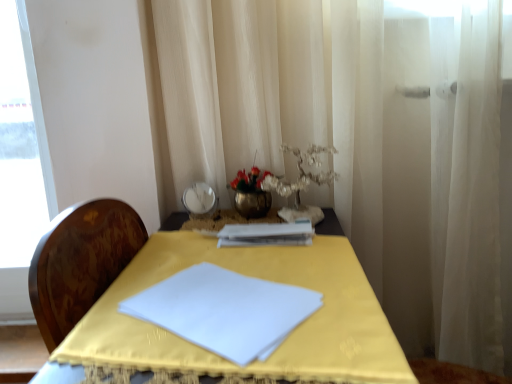
Question: Is white sheer curtain at right turned away from metallic vase at center?

Choices:
 (A) yes
 (B) no

Answer: (B)

Question: Considering the relative sizes of white sheer curtain at right and metallic vase at center in the image provided, is white sheer curtain at right shorter than metallic vase at center?

Choices:
 (A) no
 (B) yes

Answer: (A)

Question: Is white sheer curtain at right positioned behind metallic vase at center?

Choices:
 (A) yes
 (B) no

Answer: (B)

Question: Is metallic vase at center located within white sheer curtain at right?

Choices:
 (A) yes
 (B) no

Answer: (B)

Question: From the image's perspective, is white sheer curtain at right beneath metallic vase at center?

Choices:
 (A) yes
 (B) no

Answer: (A)

Question: Can you confirm if white sheer curtain at right is positioned to the left of metallic vase at center?

Choices:
 (A) yes
 (B) no

Answer: (B)

Question: Is yellow fabric table at center behind white sheer curtain at right?

Choices:
 (A) yes
 (B) no

Answer: (B)

Question: Is yellow fabric table at center far away from white sheer curtain at right?

Choices:
 (A) yes
 (B) no

Answer: (B)

Question: Is white sheer curtain at right inside yellow fabric table at center?

Choices:
 (A) no
 (B) yes

Answer: (A)

Question: From the image's perspective, is yellow fabric table at center over white sheer curtain at right?

Choices:
 (A) no
 (B) yes

Answer: (A)

Question: From the image's perspective, is yellow fabric table at center beneath white sheer curtain at right?

Choices:
 (A) yes
 (B) no

Answer: (A)

Question: Is yellow fabric table at center facing towards white sheer curtain at right?

Choices:
 (A) no
 (B) yes

Answer: (A)

Question: Considering the relative sizes of white paper journal at center and white sheer curtain at right in the image provided, is white paper journal at center smaller than white sheer curtain at right?

Choices:
 (A) no
 (B) yes

Answer: (B)